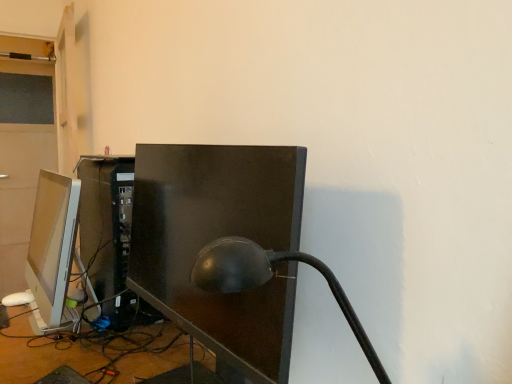
The image size is (512, 384). I want to click on matte black monitor at center, placed as the 1th computer monitor when sorted from right to left, so click(217, 238).

At what (x,y) coordinates should I click in order to perform the action: click on matte white monitor at left, the 1th computer monitor in the left-to-right sequence. Please return your answer as a coordinate pair (x, y). This screenshot has height=384, width=512. Looking at the image, I should click on (51, 248).

Where is `matte black lamp at center`? The height and width of the screenshot is (384, 512). matte black lamp at center is located at coordinates (268, 280).

Identify the location of matte black monitor at center, placed as the 1th computer monitor when sorted from right to left. Image resolution: width=512 pixels, height=384 pixels. (217, 238).

Is matte black lamp at center smaller than matte white monitor at left, the 1th computer monitor in the left-to-right sequence?

Indeed, matte black lamp at center has a smaller size compared to matte white monitor at left, the 1th computer monitor in the left-to-right sequence.

In the scene shown: In terms of height, does matte black lamp at center look taller or shorter compared to matte white monitor at left, the 1th computer monitor in the left-to-right sequence?

matte black lamp at center is shorter than matte white monitor at left, the 1th computer monitor in the left-to-right sequence.

Is matte black lamp at center positioned beyond the bounds of matte white monitor at left, the 1th computer monitor in the left-to-right sequence?

Yes, matte black lamp at center is not within matte white monitor at left, the 1th computer monitor in the left-to-right sequence.

Looking at their sizes, would you say matte black lamp at center is wider or thinner than matte white monitor at left, the 1th computer monitor in the left-to-right sequence?

Considering their sizes, matte black lamp at center looks broader than matte white monitor at left, the 1th computer monitor in the left-to-right sequence.

Can you confirm if matte black monitor at center, placed as the 1th computer monitor when sorted from right to left, is positioned to the right of matte black lamp at center?

Incorrect, matte black monitor at center, placed as the 1th computer monitor when sorted from right to left, is not on the right side of matte black lamp at center.

Is point (140, 288) in front of point (316, 265)?

No, (140, 288) is behind (316, 265).

Based on the photo, is matte black monitor at center, placed as the 1th computer monitor when sorted from right to left, positioned before matte black lamp at center?

No, matte black monitor at center, placed as the 1th computer monitor when sorted from right to left, is behind matte black lamp at center.

Based on the photo, which object is positioned more to the left, matte white monitor at left, positioned as the second computer monitor in right-to-left order, or matte black monitor at center, placed as the 1th computer monitor when sorted from right to left?

matte white monitor at left, positioned as the second computer monitor in right-to-left order.

Is matte white monitor at left, positioned as the second computer monitor in right-to-left order, facing away from matte black monitor at center, placed as the second computer monitor when sorted from left to right?

matte white monitor at left, positioned as the second computer monitor in right-to-left order, does not have its back to matte black monitor at center, placed as the second computer monitor when sorted from left to right.

From the picture: Does matte white monitor at left, positioned as the second computer monitor in right-to-left order, have a greater width compared to matte black monitor at center, placed as the 1th computer monitor when sorted from right to left?

In fact, matte white monitor at left, positioned as the second computer monitor in right-to-left order, might be narrower than matte black monitor at center, placed as the 1th computer monitor when sorted from right to left.

Does matte white monitor at left, positioned as the second computer monitor in right-to-left order, have a greater height compared to matte black monitor at center, placed as the 1th computer monitor when sorted from right to left?

Incorrect, the height of matte white monitor at left, positioned as the second computer monitor in right-to-left order, is not larger of that of matte black monitor at center, placed as the 1th computer monitor when sorted from right to left.

Are matte black monitor at center, placed as the second computer monitor when sorted from left to right, and matte white monitor at left, the 1th computer monitor in the left-to-right sequence, beside each other?

They are not placed beside each other.

Based on the photo, can you confirm if matte black monitor at center, placed as the 1th computer monitor when sorted from right to left, is shorter than matte white monitor at left, positioned as the second computer monitor in right-to-left order?

No, matte black monitor at center, placed as the 1th computer monitor when sorted from right to left, is not shorter than matte white monitor at left, positioned as the second computer monitor in right-to-left order.

From the image's perspective, who appears lower, matte black monitor at center, placed as the second computer monitor when sorted from left to right, or matte white monitor at left, the 1th computer monitor in the left-to-right sequence?

matte black monitor at center, placed as the second computer monitor when sorted from left to right.

From the image's perspective, is matte white monitor at left, positioned as the second computer monitor in right-to-left order, below matte black lamp at center?

Actually, matte white monitor at left, positioned as the second computer monitor in right-to-left order, appears above matte black lamp at center in the image.

Considering the points (41, 175) and (257, 252), which point is behind, point (41, 175) or point (257, 252)?

Point (41, 175)

Considering the sizes of objects matte white monitor at left, the 1th computer monitor in the left-to-right sequence, and matte black lamp at center in the image provided, who is bigger, matte white monitor at left, the 1th computer monitor in the left-to-right sequence, or matte black lamp at center?

With larger size is matte white monitor at left, the 1th computer monitor in the left-to-right sequence.

Does matte black lamp at center touch matte black monitor at center, placed as the second computer monitor when sorted from left to right?

No, matte black lamp at center is not touching matte black monitor at center, placed as the second computer monitor when sorted from left to right.

Is matte black lamp at center outside of matte black monitor at center, placed as the 1th computer monitor when sorted from right to left?

Indeed, matte black lamp at center is completely outside matte black monitor at center, placed as the 1th computer monitor when sorted from right to left.

How distant is matte black lamp at center from matte black monitor at center, placed as the second computer monitor when sorted from left to right?

The distance of matte black lamp at center from matte black monitor at center, placed as the second computer monitor when sorted from left to right, is 8.08 inches.

Considering the sizes of matte black lamp at center and matte black monitor at center, placed as the 1th computer monitor when sorted from right to left, in the image, is matte black lamp at center wider or thinner than matte black monitor at center, placed as the 1th computer monitor when sorted from right to left,?

Clearly, matte black lamp at center has more width compared to matte black monitor at center, placed as the 1th computer monitor when sorted from right to left.

Locate an element on the screen. This screenshot has width=512, height=384. the 2nd computer monitor above the matte black lamp at center (from the image's perspective) is located at coordinates (51, 248).

I want to click on table lamp located above the matte black monitor at center, placed as the 1th computer monitor when sorted from right to left (from a real-world perspective), so click(268, 280).

When comparing their distances from matte white monitor at left, positioned as the second computer monitor in right-to-left order, does matte black monitor at center, placed as the 1th computer monitor when sorted from right to left, or matte black lamp at center seem further?

matte black lamp at center is positioned further to the anchor matte white monitor at left, positioned as the second computer monitor in right-to-left order.

Which object lies nearer to the anchor point matte black lamp at center, matte white monitor at left, positioned as the second computer monitor in right-to-left order, or matte black monitor at center, placed as the second computer monitor when sorted from left to right?

matte black monitor at center, placed as the second computer monitor when sorted from left to right, is closer to matte black lamp at center.

Based on their spatial positions, is matte black lamp at center or matte white monitor at left, the 1th computer monitor in the left-to-right sequence, further from matte black monitor at center, placed as the 1th computer monitor when sorted from right to left?

Among the two, matte white monitor at left, the 1th computer monitor in the left-to-right sequence, is located further to matte black monitor at center, placed as the 1th computer monitor when sorted from right to left.

From the image, which object appears to be farther from matte black lamp at center, matte black monitor at center, placed as the second computer monitor when sorted from left to right, or matte white monitor at left, the 1th computer monitor in the left-to-right sequence?

The object further to matte black lamp at center is matte white monitor at left, the 1th computer monitor in the left-to-right sequence.

Looking at the image, which one is located further to matte black monitor at center, placed as the 1th computer monitor when sorted from right to left, matte white monitor at left, the 1th computer monitor in the left-to-right sequence, or matte black lamp at center?

matte white monitor at left, the 1th computer monitor in the left-to-right sequence, is further to matte black monitor at center, placed as the 1th computer monitor when sorted from right to left.

Based on their spatial positions, is matte black lamp at center or matte black monitor at center, placed as the 1th computer monitor when sorted from right to left, closer to matte white monitor at left, the 1th computer monitor in the left-to-right sequence?

matte black monitor at center, placed as the 1th computer monitor when sorted from right to left, lies closer to matte white monitor at left, the 1th computer monitor in the left-to-right sequence, than the other object.

Identify the location of computer monitor situated between matte white monitor at left, positioned as the second computer monitor in right-to-left order, and matte black lamp at center from left to right. (217, 238).